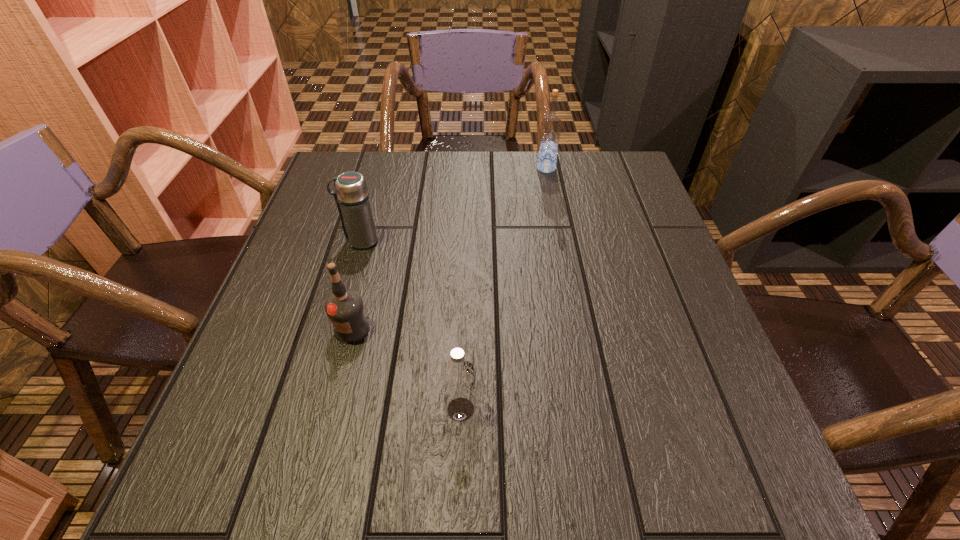
The height and width of the screenshot is (540, 960). Find the location of `the third closest object to the farthest vodka`. the third closest object to the farthest vodka is located at coordinates pyautogui.click(x=458, y=375).

Identify which object is the second nearest to the second nearest object. Please provide its 2D coordinates. Your answer should be formatted as a tuple, i.e. [(x, y)], where the tuple contains the x and y coordinates of a point satisfying the conditions above.

[(351, 194)]

What are the coordinates of `vodka identified as the second closest to the leftmost vodka` in the screenshot? It's located at (550, 130).

Select which vodka is the closest to the thermos bottle. Please provide its 2D coordinates. Your answer should be formatted as a tuple, i.e. [(x, y)], where the tuple contains the x and y coordinates of a point satisfying the conditions above.

[(345, 308)]

Locate an element on the screen. vacant position in the image that satisfies the following two spatial constraints: 1. on the front side of the farthest object; 2. with a handle on the side of the second farthest object is located at coordinates (560, 241).